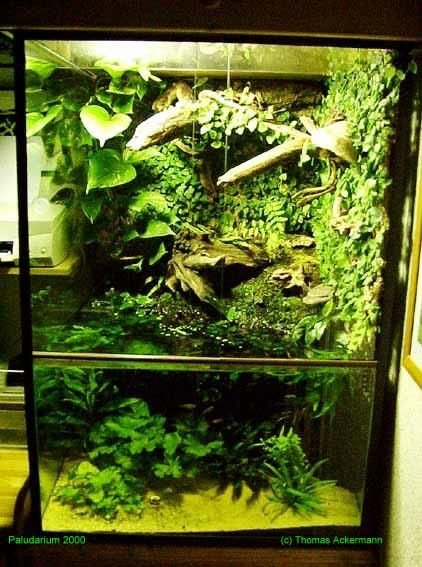
At what (x,y) coordinates should I click in order to perform the action: click on frame. Please return your answer as a coordinate pair (x, y). Looking at the image, I should click on (410, 371).